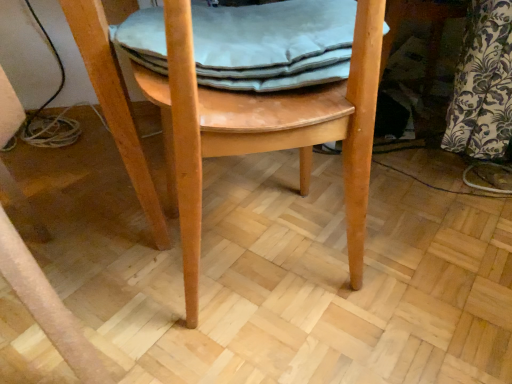
What are the coordinates of `vacant region to the left of light brown wood chair at center` in the screenshot? It's located at (100, 253).